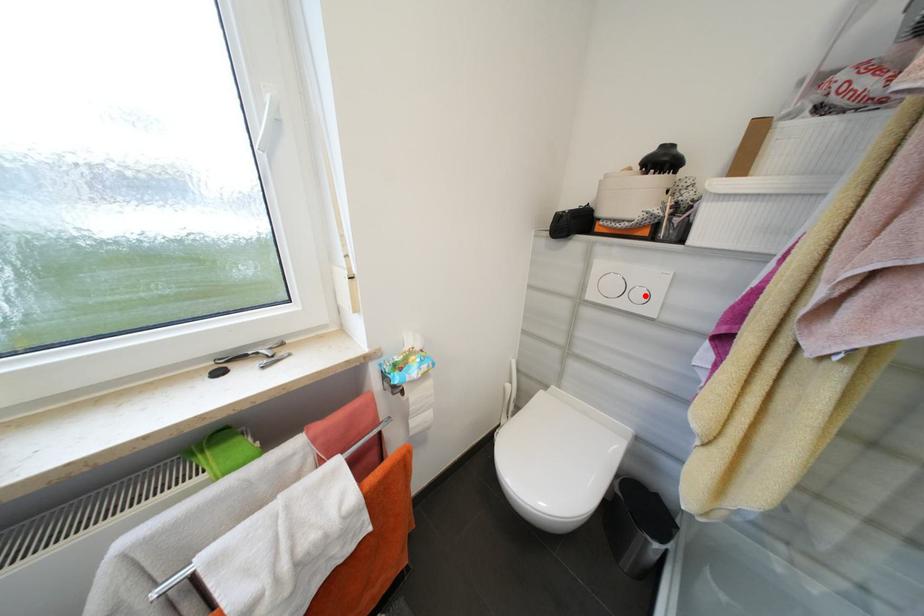
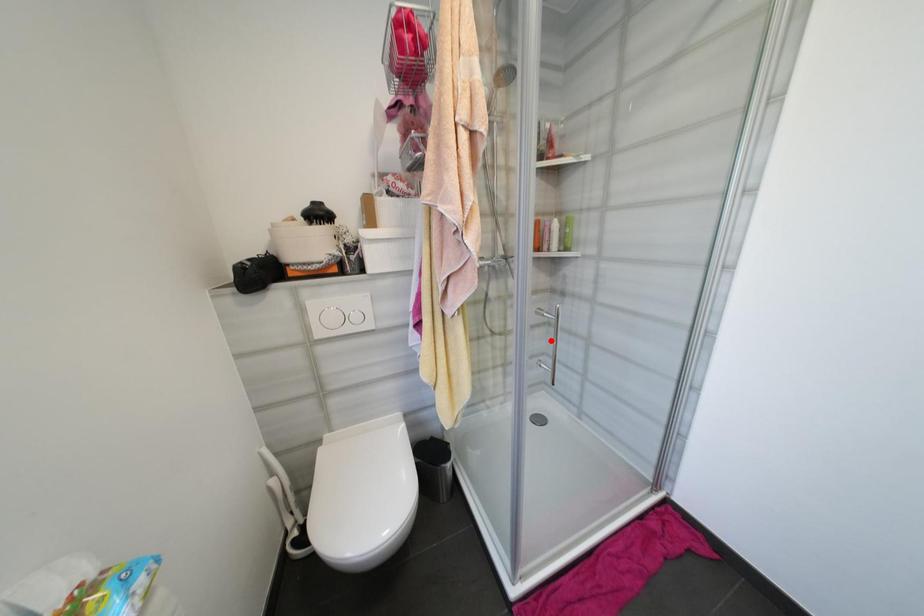
I am providing you with two images of the same scene from different viewpoints. A red point is marked on the first image and another point is marked on the second image. Does the point marked in image1 correspond to the same location as the one in image2?

No